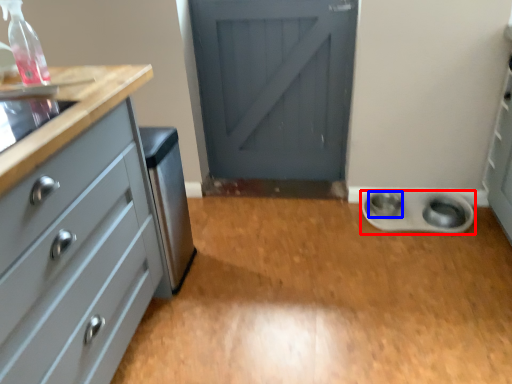
Question: Which object is closer to the camera taking this photo, appliance (highlighted by a red box) or knob (highlighted by a blue box)?

Choices:
 (A) appliance
 (B) knob

Answer: (A)